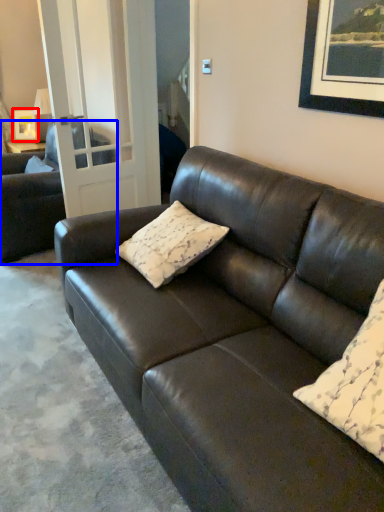
Question: Which object appears farthest to the camera in this image, picture frame (highlighted by a red box) or studio couch (highlighted by a blue box)?

Choices:
 (A) picture frame
 (B) studio couch

Answer: (A)